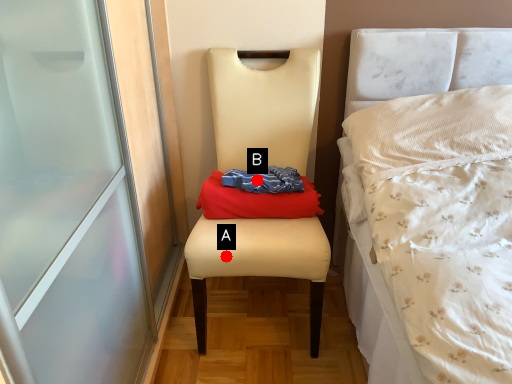
Question: Two points are circled on the image, labeled by A and B beside each circle. Which point is further to the camera?

Choices:
 (A) A is further
 (B) B is further

Answer: (B)